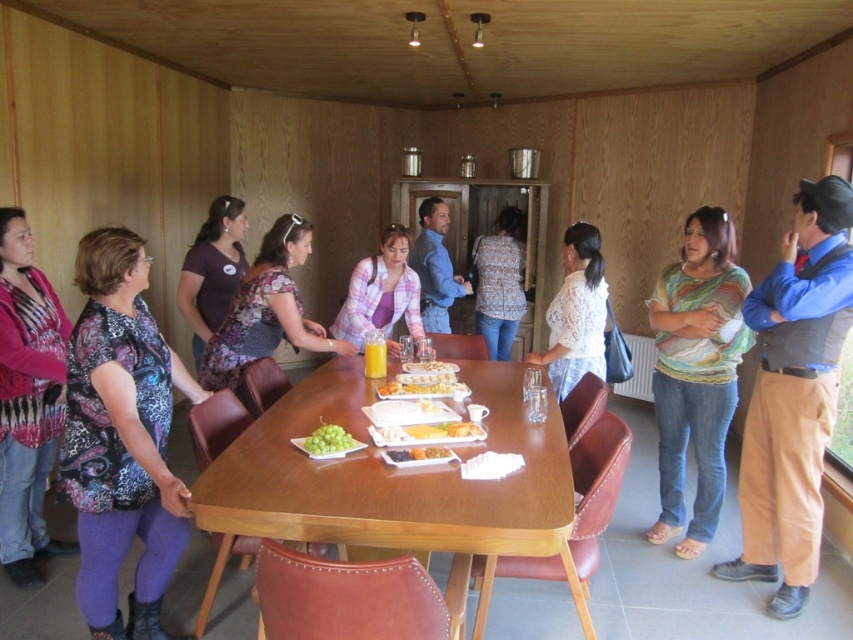
Is pink fabric shirt at center below green matte grapes at center?

Incorrect, pink fabric shirt at center is not positioned below green matte grapes at center.

What do you see at coordinates (381, 292) in the screenshot? This screenshot has height=640, width=853. I see `pink fabric shirt at center` at bounding box center [381, 292].

Locate an element on the screen. pink fabric shirt at center is located at coordinates (381, 292).

Can you confirm if blue denim jeans at center is wider than white glossy plate at center?

Yes.

Is blue denim jeans at center thinner than white glossy plate at center?

No, blue denim jeans at center is not thinner than white glossy plate at center.

Is point (430, 262) closer to viewer compared to point (413, 365)?

That is False.

The width and height of the screenshot is (853, 640). What are the coordinates of `blue denim jeans at center` in the screenshot? It's located at (434, 266).

Is patterned fabric shirt at center positioned behind yellow cheese at center?

That is True.

Find the location of a particular element. patterned fabric shirt at center is located at coordinates (498, 282).

At what (x,y) coordinates should I click in order to perform the action: click on patterned fabric shirt at center. Please return your answer as a coordinate pair (x, y). The width and height of the screenshot is (853, 640). Looking at the image, I should click on (498, 282).

Locate an element on the screen. The width and height of the screenshot is (853, 640). patterned fabric shirt at center is located at coordinates (498, 282).